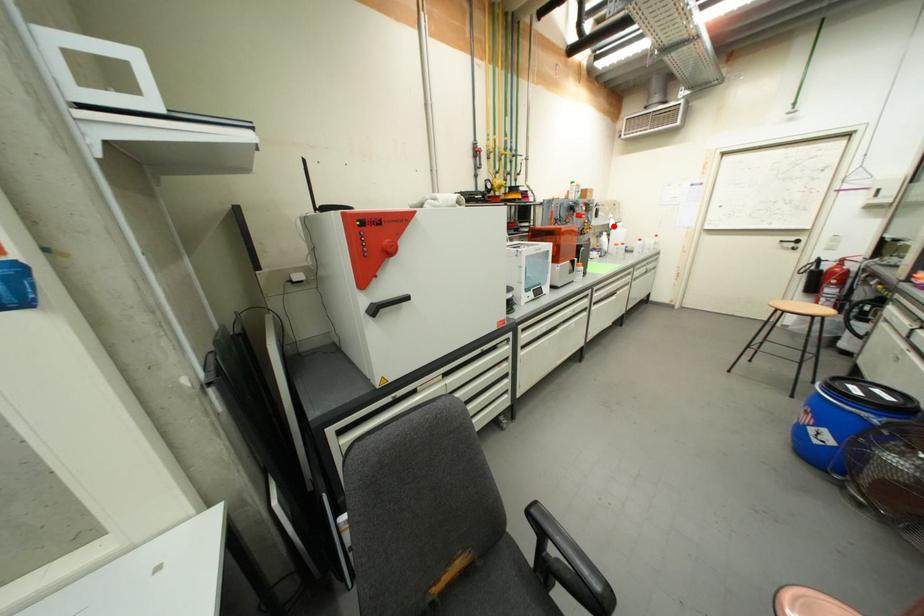
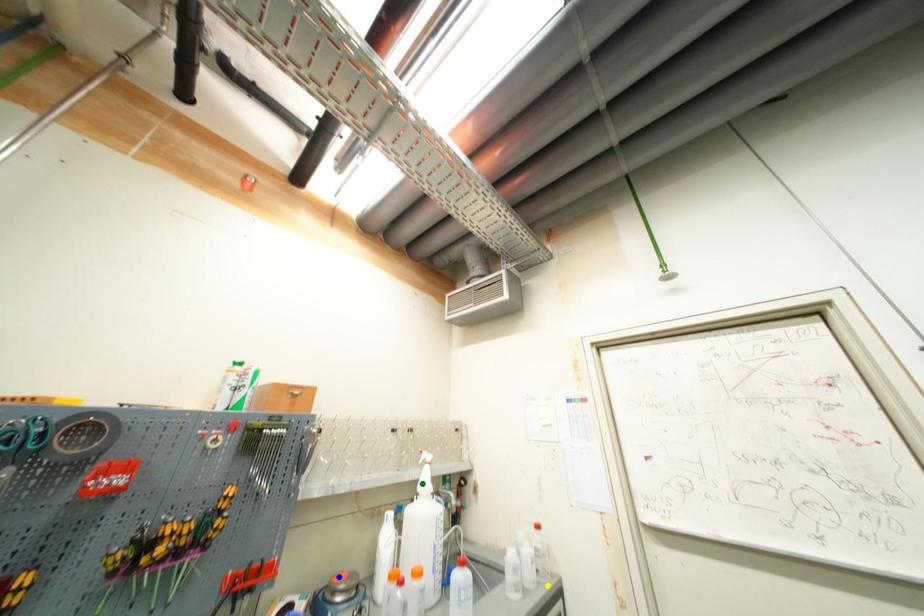
Question: I am providing you with two images of the same scene from different viewpoints. A red point is marked on the first image. You are given multiple points on the second image. Which point in image 2 is actually the same real-world point as the red point in image 1?

Choices:
 (A) blue point
 (B) yellow point
 (C) green point

Answer: (C)